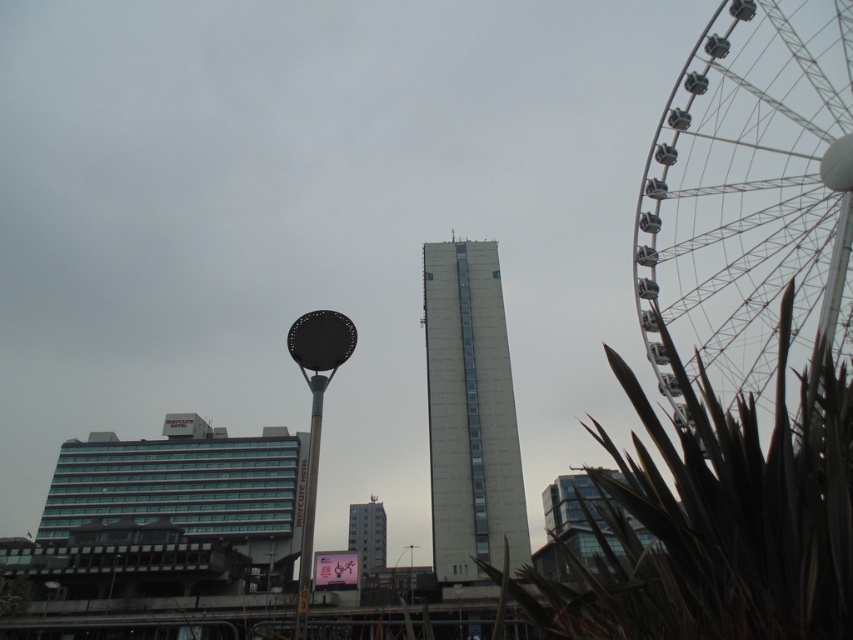
You are a city planner assessing the urban space. The metallic gray ferris wheel at right and the white glossy pole at center are both in the foreground. Which object would cast a longer shadow during midday when the sun is directly overhead?

The metallic gray ferris wheel at right is much taller than the white glossy pole at center, so it would cast a longer shadow during midday when the sun is directly overhead.

You are standing at the point marked by the coordinate point at point [747,196]. What object is located exactly at your current position?

The metallic gray ferris wheel at right is located exactly at the point [747,196].

You are standing at the center of the image and want to locate the metallic gray ferris wheel at right. According to the scene description, in which direction should you look to find it?

The metallic gray ferris wheel at right is located at the right side of the image, so you should look to your right to find it.